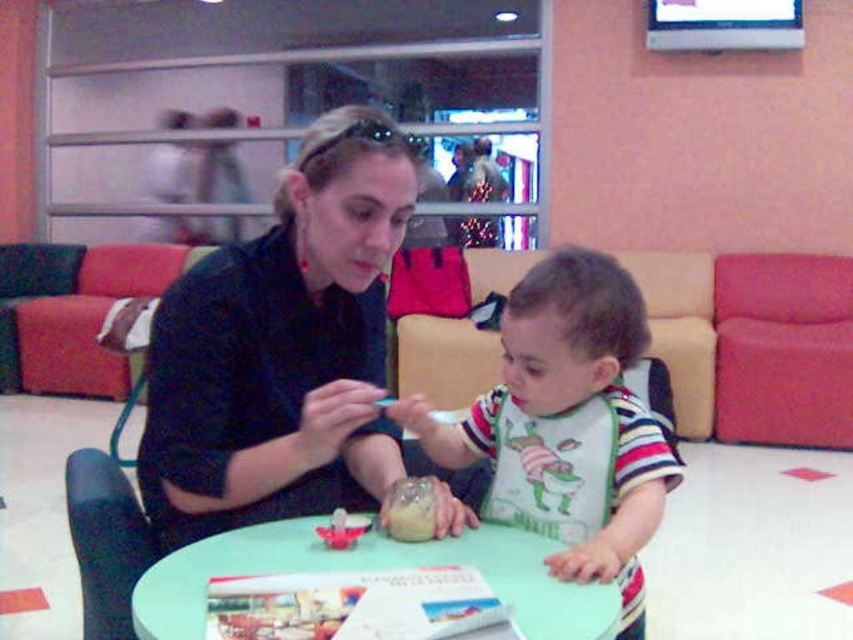
Question: Which point appears farthest from the camera in this image?

Choices:
 (A) (587, 541)
 (B) (393, 509)
 (C) (572, 582)
 (D) (368, 339)

Answer: (D)

Question: Which point is closer to the camera?

Choices:
 (A) green plastic table at center
 (B) translucent plastic cup at table
 (C) striped cotton bib at center

Answer: (A)

Question: Does matte black shirt at center appear on the left side of translucent plastic cup at center?

Choices:
 (A) yes
 (B) no

Answer: (A)

Question: Which point is closer to the camera?

Choices:
 (A) (431, 536)
 (B) (556, 282)
 (C) (346, 536)

Answer: (C)

Question: Can you confirm if striped cotton bib at center is positioned to the left of translucent plastic cup at center?

Choices:
 (A) yes
 (B) no

Answer: (B)

Question: Does translucent plastic cup at table have a lesser width compared to translucent plastic cup at center?

Choices:
 (A) no
 (B) yes

Answer: (A)